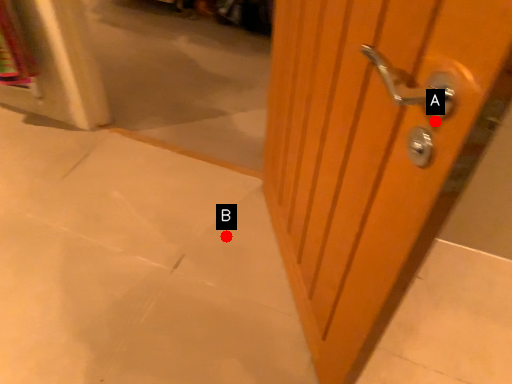
Question: Two points are circled on the image, labeled by A and B beside each circle. Which point is closer to the camera?

Choices:
 (A) A is closer
 (B) B is closer

Answer: (A)